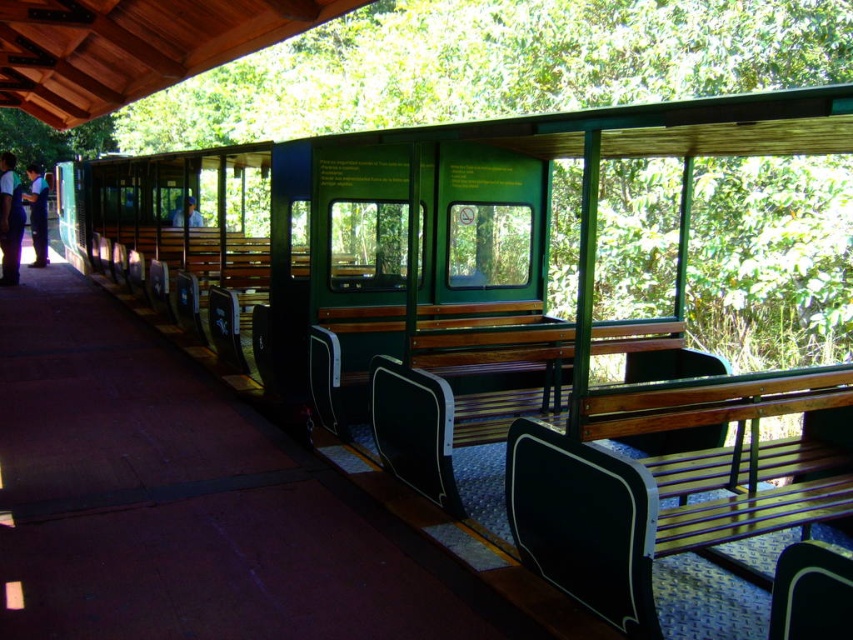
You are standing on the platform at the train station and want to take a photo of both the point at coordinates point (846,612) and point (16,193). Based on their positions, which point will appear larger in your photo?

Point (846,612) is closer to the camera than point (16,193), so it will appear larger in the photo.

You are a passenger at the train station and need to sit down. You see a black plastic chair at lower right and a black fabric shirt at left. Which object can you sit on?

The black plastic chair at lower right can be sat on, while the black fabric shirt at left is not a seating option.

You are standing at the entrance of the train station and want to sit on the green matte bench at center. Which direction should you walk to reach it?

To reach the green matte bench at center, you should walk towards the center of the platform where it is located.